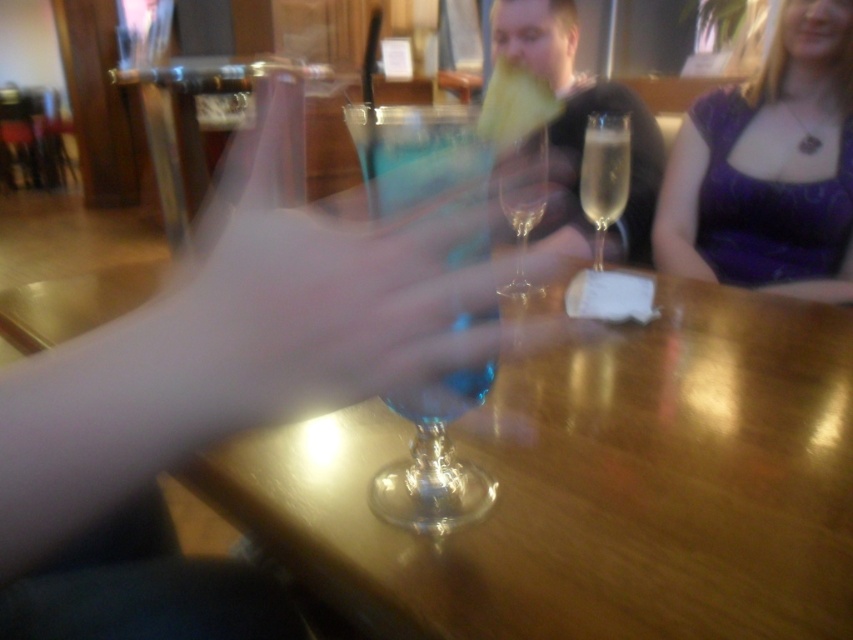
Question: Which of the following is the closest to the observer?

Choices:
 (A) (515, 234)
 (B) (477, 488)
 (C) (604, 152)
 (D) (519, 58)

Answer: (B)

Question: Which object is farther from the camera taking this photo?

Choices:
 (A) translucent glass hand at center
 (B) transparent glass wine glass at center
 (C) clear glass wine glass at center
 (D) transparent glass at center

Answer: (C)

Question: Which object appears farthest from the camera in this image?

Choices:
 (A) clear glass champagne flute at center
 (B) transparent glass wine glass at center
 (C) clear glass wine glass at center
 (D) transparent glass at center

Answer: (C)

Question: Does purple fabric dress at upper right appear on the right side of transparent glass wine glass at center?

Choices:
 (A) yes
 (B) no

Answer: (A)

Question: Can you confirm if transparent glass at center is smaller than purple fabric dress at upper right?

Choices:
 (A) yes
 (B) no

Answer: (B)

Question: Does transparent glass at center appear on the right side of clear glass champagne flute at center?

Choices:
 (A) no
 (B) yes

Answer: (A)